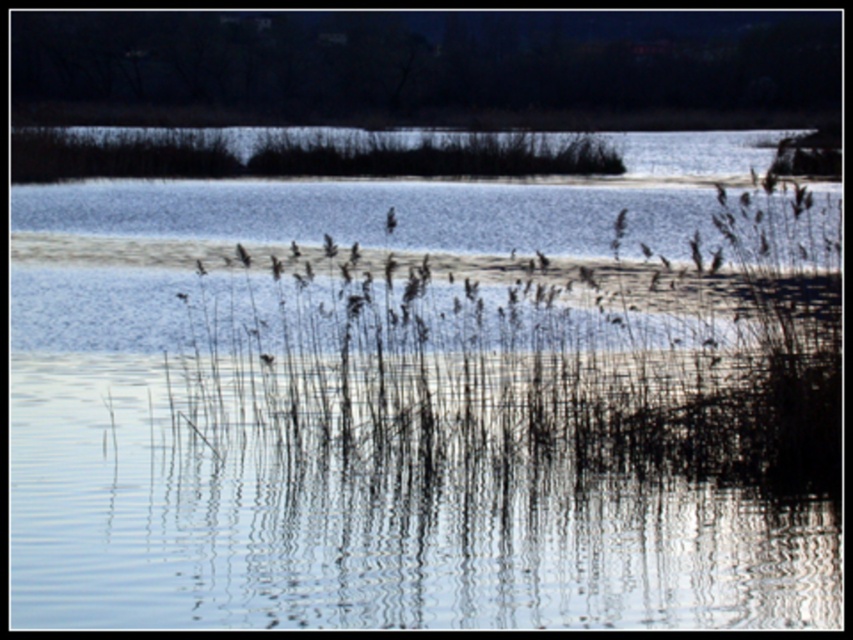
Is clear water at center to the right of brown grass at center from the viewer's perspective?

In fact, clear water at center is to the left of brown grass at center.

Which is in front, point (22, 392) or point (537, 369)?

Point (537, 369) is more forward.

I want to click on clear water at center, so click(372, 513).

You are a GUI agent. You are given a task and a screenshot of the screen. Output one action in this format:
    pyautogui.click(x=<x>, y=<y>)
    Task: Click on the clear water at center
    Image resolution: width=853 pixels, height=640 pixels.
    Given the screenshot: What is the action you would take?
    pyautogui.click(x=372, y=513)